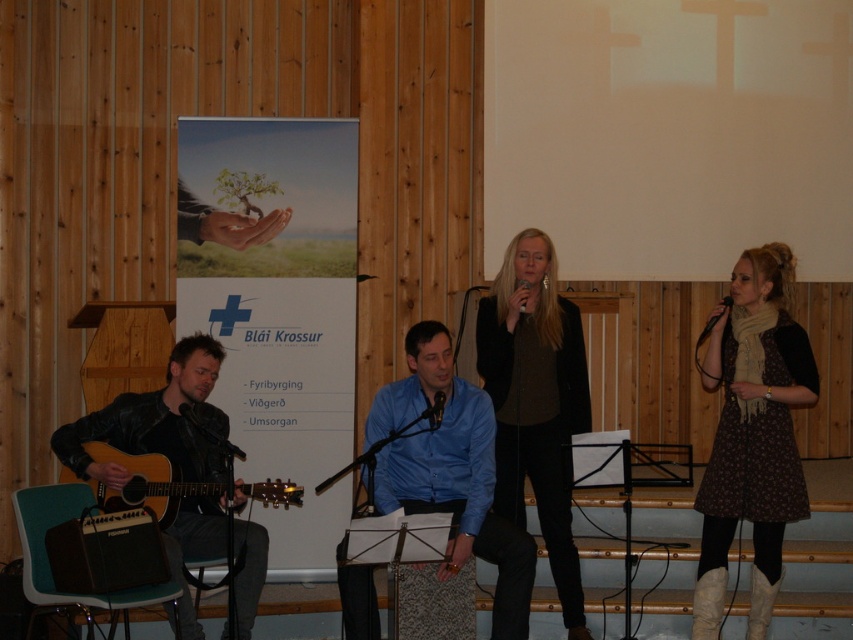
You are a stagehand setting up for a performance. You need to adjust the black matte microphone at lower left and the black matte microphone at center so that they are aligned properly. Which microphone should you move forward to achieve this alignment?

The black matte microphone at lower left is already in front of the black matte microphone at center. To align them properly, you should move the black matte microphone at center forward to match the position of the black matte microphone at lower left.

Based on the photo, you are a sound technician setting up for a live performance. You need to adjust the height of the black matte microphone at lower left and the black matte microphone at center so that they are the same height. Which microphone should you lower and which one should you raise?

The black matte microphone at lower left is taller than the black matte microphone at center. Therefore, you should lower the black matte microphone at lower left and raise the black matte microphone at center to make them the same height.

You are standing in the performance area and need to move to a point that is exactly 20 feet away from you. The point you need to reach is marked as point (x=583, y=374). Based on the scene description, can you reach the desired point without moving beyond the performance area?

The distance between point (x=583, y=374) and the viewer is 18.53 feet, which is less than 20 feet. Therefore, you can reach the desired point without moving beyond the performance area.